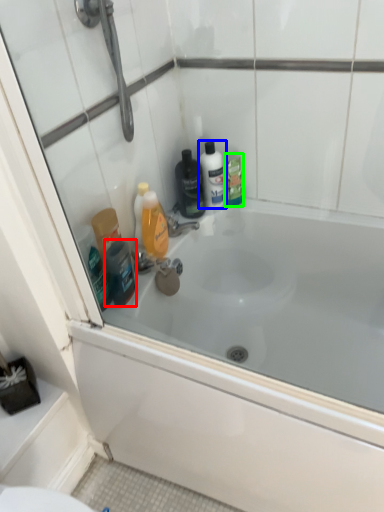
Question: Estimate the real-world distances between objects in this image. Which object is closer to toiletry (highlighted by a red box), mouthwash (highlighted by a blue box) or mouthwash (highlighted by a green box)?

Choices:
 (A) mouthwash
 (B) mouthwash

Answer: (A)